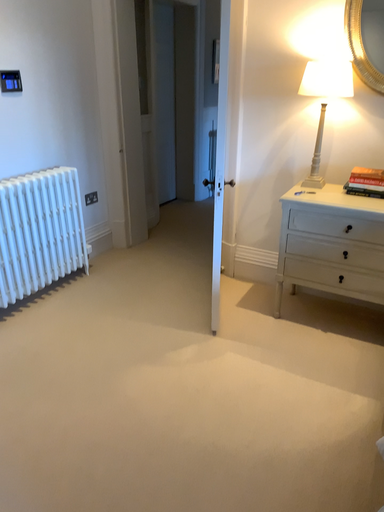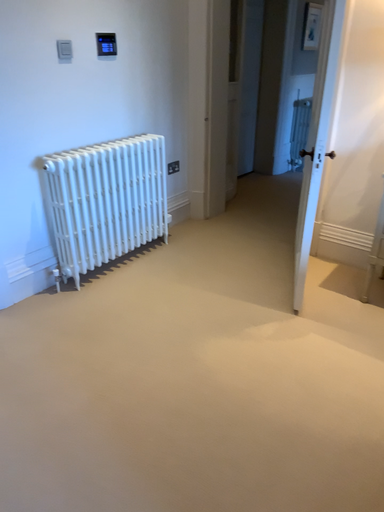
Question: Which way did the camera rotate in the video?

Choices:
 (A) rotated left
 (B) rotated right

Answer: (A)